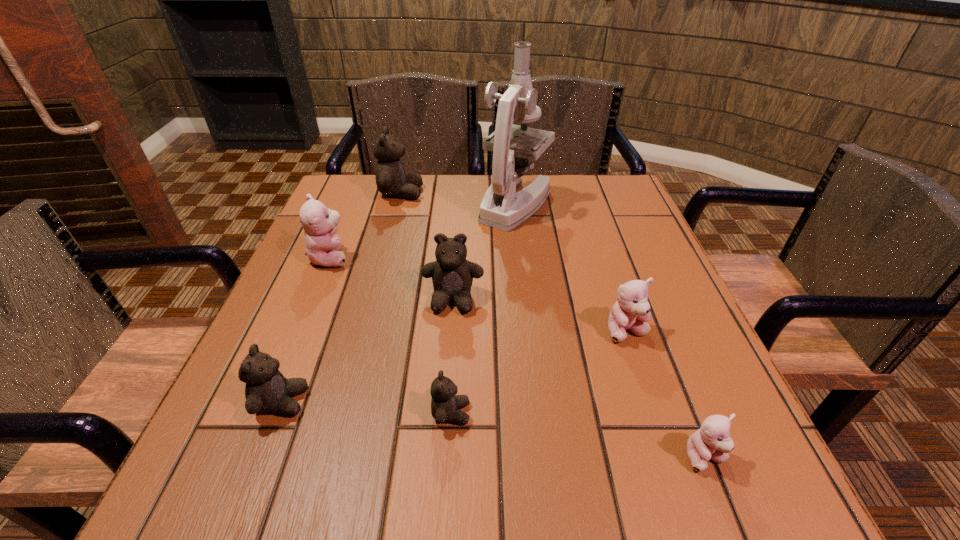
In order to click on free point between the farthest brown teddy bear and the fifth farthest object in this screenshot , I will do `click(514, 262)`.

The image size is (960, 540). What are the coordinates of `free area in between the third object from left to right and the second nearest pink teddy bear` in the screenshot? It's located at click(514, 262).

At what (x,y) coordinates should I click in order to perform the action: click on vacant area between the second nearest pink teddy bear and the nearest object. Please return your answer as a coordinate pair (x, y). Looking at the image, I should click on (666, 394).

The width and height of the screenshot is (960, 540). In order to click on object that can be found as the fourth closest to the second smallest pink teddy bear in this screenshot , I will do `click(501, 207)`.

At what (x,y) coordinates should I click in order to perform the action: click on object that stands as the seventh closest to the gray microscope. Please return your answer as a coordinate pair (x, y). The width and height of the screenshot is (960, 540). Looking at the image, I should click on (712, 441).

Select which teddy bear appears as the second closest to the seventh shortest object. Please provide its 2D coordinates. Your answer should be formatted as a tuple, i.e. [(x, y)], where the tuple contains the x and y coordinates of a point satisfying the conditions above.

[(452, 275)]

Point out which teddy bear is positioned as the second nearest to the second smallest pink teddy bear. Please provide its 2D coordinates. Your answer should be formatted as a tuple, i.e. [(x, y)], where the tuple contains the x and y coordinates of a point satisfying the conditions above.

[(452, 275)]

Point out which brown teddy bear is positioned as the second nearest to the nearest pink teddy bear. Please provide its 2D coordinates. Your answer should be formatted as a tuple, i.e. [(x, y)], where the tuple contains the x and y coordinates of a point satisfying the conditions above.

[(452, 275)]

Point out which brown teddy bear is positioned as the third nearest to the smallest brown teddy bear. Please provide its 2D coordinates. Your answer should be formatted as a tuple, i.e. [(x, y)], where the tuple contains the x and y coordinates of a point satisfying the conditions above.

[(391, 180)]

I want to click on pink teddy bear that can be found as the third closest to the farthest teddy bear, so click(712, 441).